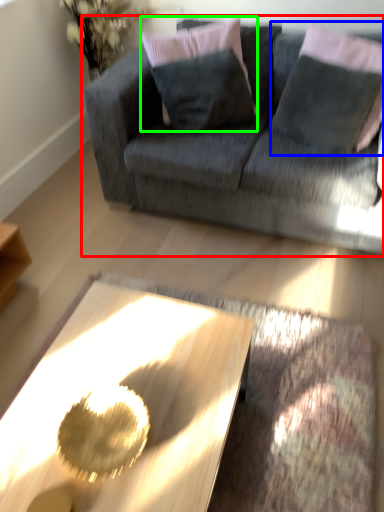
Question: Which is farther away from studio couch (highlighted by a red box)? pillow (highlighted by a blue box) or pillow (highlighted by a green box)?

Choices:
 (A) pillow
 (B) pillow

Answer: (A)